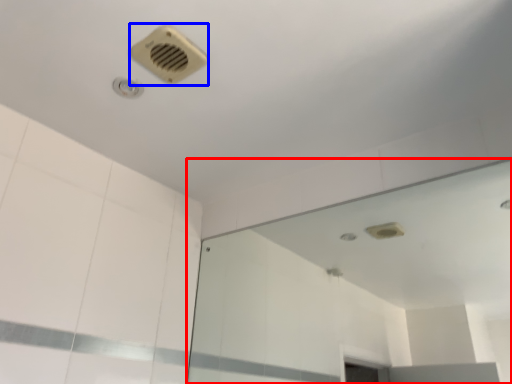
Question: Among these objects, which one is farthest to the camera, mirror (highlighted by a red box) or air conditioning (highlighted by a blue box)?

Choices:
 (A) mirror
 (B) air conditioning

Answer: (B)